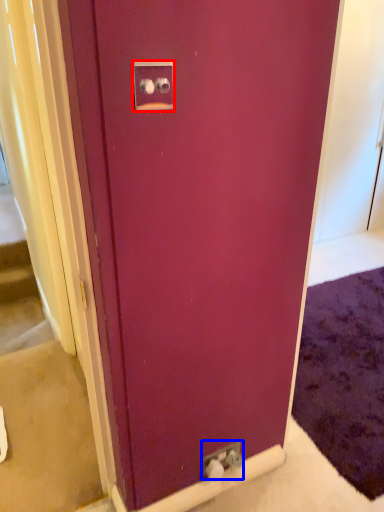
Question: Which object appears farthest to the camera in this image, electric outlet (highlighted by a red box) or electric outlet (highlighted by a blue box)?

Choices:
 (A) electric outlet
 (B) electric outlet

Answer: (B)